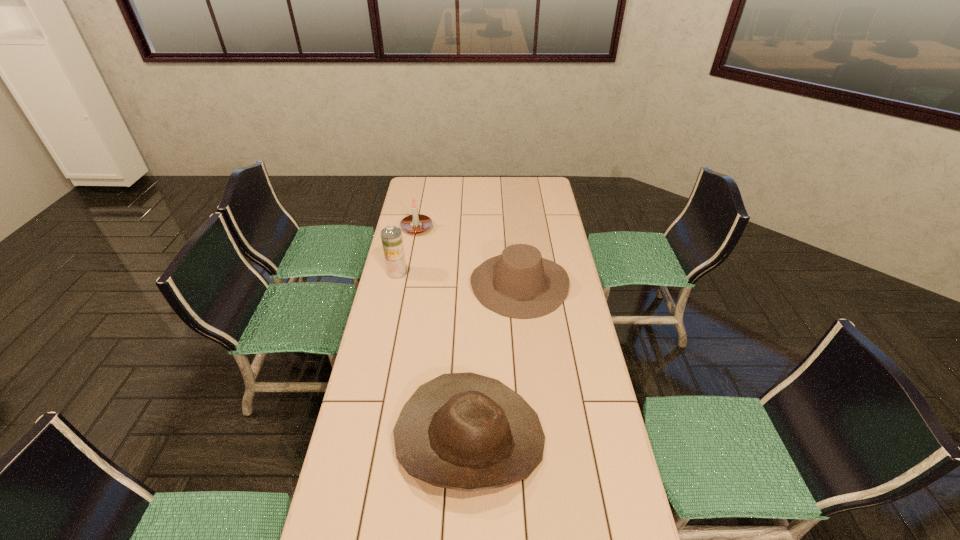
Locate an element on the screen. aerosol can is located at coordinates (391, 236).

The height and width of the screenshot is (540, 960). I want to click on the farthest object, so click(417, 223).

Locate an element on the screen. the nearest object is located at coordinates (464, 431).

Locate an element on the screen. This screenshot has height=540, width=960. the farther cowboy hat is located at coordinates (519, 283).

Identify the location of vacant space situated 0.240m on the back of the aerosol can. Image resolution: width=960 pixels, height=540 pixels. (405, 234).

At what (x,y) coordinates should I click in order to perform the action: click on vacant space situated 0.070m on the front of the candle. Please return your answer as a coordinate pair (x, y). This screenshot has width=960, height=540. Looking at the image, I should click on (414, 246).

The height and width of the screenshot is (540, 960). I want to click on free region located on the back of the nearest object, so click(x=471, y=361).

Identify the location of vacant space situated 0.070m on the back of the farther cowboy hat. (516, 244).

Locate an element on the screen. aerosol can located at the left edge is located at coordinates (391, 236).

This screenshot has height=540, width=960. In order to click on candle situated at the left edge in this screenshot , I will do `click(417, 223)`.